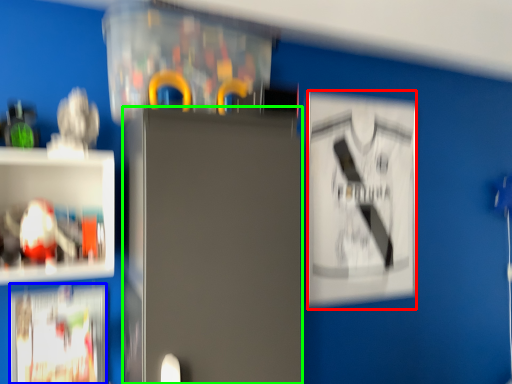
Question: Based on their relative distances, which object is nearer to poster (highlighted by a red box)? Choose from poster (highlighted by a blue box) and fridge (highlighted by a green box).

Choices:
 (A) poster
 (B) fridge

Answer: (B)